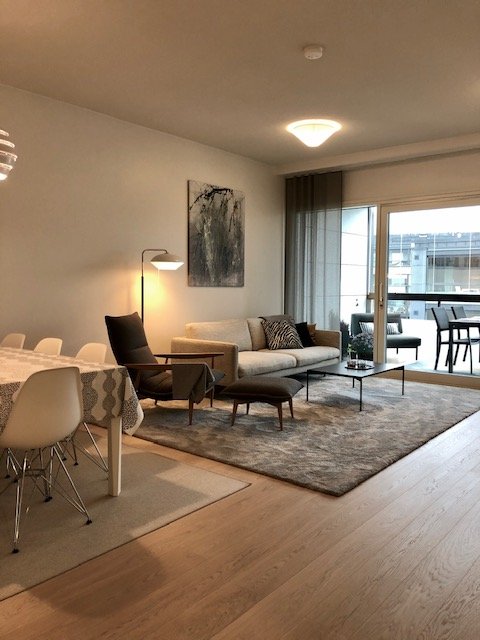
Identify the location of orange lights. (315, 129), (147, 285), (166, 265).